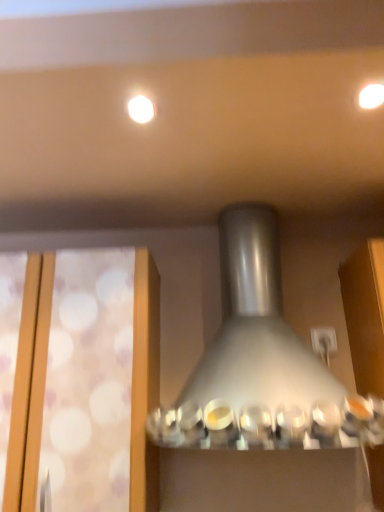
Identify the location of white glossy light fixture at upper center, which is the 1th lighting from left to right. (141, 109).

You are a GUI agent. You are given a task and a screenshot of the screen. Output one action in this format:
    pyautogui.click(x=<x>, y=<y>)
    Task: Click on the satin silver lamp at center
    
    Given the screenshot: What is the action you would take?
    pyautogui.click(x=261, y=362)

Does satin silver lamp at center appear on the right side of translucent frosted glass at left?

Correct, you'll find satin silver lamp at center to the right of translucent frosted glass at left.

Which is farther, (235, 243) or (27, 315)?

The point (235, 243) is farther from the camera.

In the scene shown: Could you tell me if satin silver lamp at center is facing translucent frosted glass at left?

No, satin silver lamp at center is not aimed at translucent frosted glass at left.

Considering the relative sizes of satin silver lamp at center and translucent frosted glass at left in the image provided, is satin silver lamp at center smaller than translucent frosted glass at left?

Incorrect, satin silver lamp at center is not smaller in size than translucent frosted glass at left.

How many degrees apart are the facing directions of white glossy light fixture at upper center, which is the 1th lighting from left to right, and translucent frosted glass at left?

white glossy light fixture at upper center, which is the 1th lighting from left to right, and translucent frosted glass at left are facing 0.898 degrees away from each other.

Is white glossy light fixture at upper center, the second lighting in the right-to-left sequence, aimed at translucent frosted glass at left?

No, white glossy light fixture at upper center, the second lighting in the right-to-left sequence, is not oriented towards translucent frosted glass at left.

Considering the sizes of objects white glossy light fixture at upper center, which is the 1th lighting from left to right, and translucent frosted glass at left in the image provided, who is wider, white glossy light fixture at upper center, which is the 1th lighting from left to right, or translucent frosted glass at left?

With larger width is translucent frosted glass at left.

Does white glossy light fixture at upper center, the second lighting in the right-to-left sequence, touch translucent frosted glass at left?

No.

Which object is positioned more to the left, white glossy light fixture at upper center, the second lighting in the right-to-left sequence, or satin silver lamp at center?

Positioned to the left is white glossy light fixture at upper center, the second lighting in the right-to-left sequence.

Would you say white glossy light fixture at upper center, which is the 1th lighting from left to right, is inside or outside satin silver lamp at center?

white glossy light fixture at upper center, which is the 1th lighting from left to right, lies outside satin silver lamp at center.

From the image's perspective, is white glossy light fixture at upper center, which is the 1th lighting from left to right, under satin silver lamp at center?

No, from the image's perspective, white glossy light fixture at upper center, which is the 1th lighting from left to right, is not beneath satin silver lamp at center.

Considering the relative sizes of white glossy light fixture at upper center, which is the 1th lighting from left to right, and satin silver lamp at center in the image provided, is white glossy light fixture at upper center, which is the 1th lighting from left to right, thinner than satin silver lamp at center?

Yes, white glossy light fixture at upper center, which is the 1th lighting from left to right, is thinner than satin silver lamp at center.

From the image's perspective, would you say white glossy light fixture at upper center, which is the 1th lighting from left to right, is shown under matte white light at upper right, the second lighting from the left?

Yes, from the image's perspective, white glossy light fixture at upper center, which is the 1th lighting from left to right, is below matte white light at upper right, the second lighting from the left.

Are white glossy light fixture at upper center, the second lighting in the right-to-left sequence, and matte white light at upper right, which is the 1th lighting in right-to-left order, far apart?

No, white glossy light fixture at upper center, the second lighting in the right-to-left sequence, is in close proximity to matte white light at upper right, which is the 1th lighting in right-to-left order.

Where is `lighting behind the matte white light at upper right, which is the 1th lighting in right-to-left order`? This screenshot has width=384, height=512. lighting behind the matte white light at upper right, which is the 1th lighting in right-to-left order is located at coordinates (141, 109).

Between white glossy light fixture at upper center, the second lighting in the right-to-left sequence, and matte white light at upper right, which is the 1th lighting in right-to-left order, which one has larger size?

matte white light at upper right, which is the 1th lighting in right-to-left order.

Can you tell me how much translucent frosted glass at left and white glossy light fixture at upper center, which is the 1th lighting from left to right, differ in facing direction?

0.898 degrees separate the facing orientations of translucent frosted glass at left and white glossy light fixture at upper center, which is the 1th lighting from left to right.

Are translucent frosted glass at left and white glossy light fixture at upper center, the second lighting in the right-to-left sequence, making contact?

No.

This screenshot has width=384, height=512. I want to click on glass door below the white glossy light fixture at upper center, the second lighting in the right-to-left sequence (from the image's perspective), so click(29, 385).

From their relative heights in the image, would you say translucent frosted glass at left is taller or shorter than white glossy light fixture at upper center, the second lighting in the right-to-left sequence?

translucent frosted glass at left is taller than white glossy light fixture at upper center, the second lighting in the right-to-left sequence.

How distant is satin silver lamp at center from matte white light at upper right, the second lighting from the left?

The distance of satin silver lamp at center from matte white light at upper right, the second lighting from the left, is 64.59 centimeters.

From a real-world perspective, does satin silver lamp at center stand above matte white light at upper right, the second lighting from the left?

No.

Is satin silver lamp at center thinner than matte white light at upper right, the second lighting from the left?

No.

How many degrees apart are the facing directions of satin silver lamp at center and white glossy light fixture at upper center, the second lighting in the right-to-left sequence?

The facing directions of satin silver lamp at center and white glossy light fixture at upper center, the second lighting in the right-to-left sequence, are 0.898 degrees apart.

How far apart are satin silver lamp at center and white glossy light fixture at upper center, the second lighting in the right-to-left sequence?

satin silver lamp at center and white glossy light fixture at upper center, the second lighting in the right-to-left sequence, are 25.25 inches apart from each other.

In the image, is satin silver lamp at center positioned in front of or behind white glossy light fixture at upper center, the second lighting in the right-to-left sequence?

Clearly, satin silver lamp at center is in front of white glossy light fixture at upper center, the second lighting in the right-to-left sequence.

Can you confirm if satin silver lamp at center is bigger than white glossy light fixture at upper center, which is the 1th lighting from left to right?

Indeed, satin silver lamp at center has a larger size compared to white glossy light fixture at upper center, which is the 1th lighting from left to right.

Identify the location of glass door that is under the satin silver lamp at center (from a real-world perspective). The height and width of the screenshot is (512, 384). (29, 385).

You are a GUI agent. You are given a task and a screenshot of the screen. Output one action in this format:
    pyautogui.click(x=<x>, y=<y>)
    Task: Click on the glass door that appears behind the white glossy light fixture at upper center, the second lighting in the right-to-left sequence
    This screenshot has width=384, height=512.
    Given the screenshot: What is the action you would take?
    pyautogui.click(x=29, y=385)

Estimate the real-world distances between objects in this image. Which object is closer to translucent frosted glass at left, matte white light at upper right, which is the 1th lighting in right-to-left order, or satin silver lamp at center?

satin silver lamp at center is closer to translucent frosted glass at left.

Looking at the image, which one is located further to translucent frosted glass at left, white glossy light fixture at upper center, which is the 1th lighting from left to right, or matte white light at upper right, which is the 1th lighting in right-to-left order?

Among the two, matte white light at upper right, which is the 1th lighting in right-to-left order, is located further to translucent frosted glass at left.

Based on their spatial positions, is white glossy light fixture at upper center, the second lighting in the right-to-left sequence, or satin silver lamp at center closer to translucent frosted glass at left?

Based on the image, satin silver lamp at center appears to be nearer to translucent frosted glass at left.

Looking at the image, which one is located closer to matte white light at upper right, which is the 1th lighting in right-to-left order, translucent frosted glass at left or satin silver lamp at center?

satin silver lamp at center is positioned closer to the anchor matte white light at upper right, which is the 1th lighting in right-to-left order.

Considering their positions, is matte white light at upper right, which is the 1th lighting in right-to-left order, positioned closer to satin silver lamp at center than white glossy light fixture at upper center, the second lighting in the right-to-left sequence?

white glossy light fixture at upper center, the second lighting in the right-to-left sequence.

Consider the image. When comparing their distances from satin silver lamp at center, does white glossy light fixture at upper center, which is the 1th lighting from left to right, or translucent frosted glass at left seem further?

white glossy light fixture at upper center, which is the 1th lighting from left to right.

Which object lies nearer to the anchor point white glossy light fixture at upper center, which is the 1th lighting from left to right, matte white light at upper right, the second lighting from the left, or translucent frosted glass at left?

The object closer to white glossy light fixture at upper center, which is the 1th lighting from left to right, is matte white light at upper right, the second lighting from the left.

Estimate the real-world distances between objects in this image. Which object is further from white glossy light fixture at upper center, the second lighting in the right-to-left sequence, translucent frosted glass at left or satin silver lamp at center?

translucent frosted glass at left.

At what (x,y) coordinates should I click in order to perform the action: click on lighting that lies between matte white light at upper right, the second lighting from the left, and satin silver lamp at center from top to bottom. Please return your answer as a coordinate pair (x, y). Image resolution: width=384 pixels, height=512 pixels. Looking at the image, I should click on (141, 109).

I want to click on lamp between translucent frosted glass at left and matte white light at upper right, the second lighting from the left, so click(x=261, y=362).

The width and height of the screenshot is (384, 512). What are the coordinates of `lighting between matte white light at upper right, which is the 1th lighting in right-to-left order, and translucent frosted glass at left vertically` in the screenshot? It's located at (141, 109).

Find the location of a particular element. This screenshot has width=384, height=512. lamp between white glossy light fixture at upper center, the second lighting in the right-to-left sequence, and translucent frosted glass at left in the up-down direction is located at coordinates tap(261, 362).